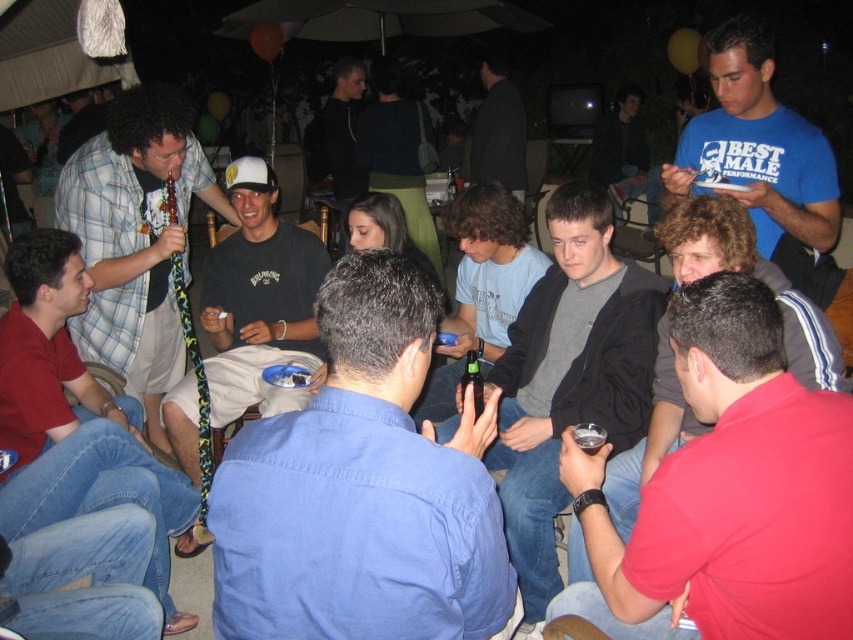
What do you see at coordinates (361, 488) in the screenshot?
I see `blue cotton shirt at center` at bounding box center [361, 488].

Is blue cotton shirt at center bigger than light blue shirt at center?

No, blue cotton shirt at center is not bigger than light blue shirt at center.

Which is in front, point (227, 618) or point (492, 352)?

Point (227, 618) is more forward.

Identify the location of blue cotton shirt at center. (361, 488).

Where is `plaid shirt at center`? plaid shirt at center is located at coordinates (136, 237).

This screenshot has width=853, height=640. Describe the element at coordinates (136, 237) in the screenshot. I see `plaid shirt at center` at that location.

At what (x,y) coordinates should I click in order to perform the action: click on plaid shirt at center. Please return your answer as a coordinate pair (x, y). The width and height of the screenshot is (853, 640). Looking at the image, I should click on (136, 237).

Who is positioned more to the left, matte black shirt at center or plaid shirt at center?

Positioned to the left is matte black shirt at center.

Does matte black shirt at center have a lesser width compared to plaid shirt at center?

No.

Is point (135, 499) less distant than point (160, 400)?

Yes, it is in front of point (160, 400).

Locate an element on the screen. The image size is (853, 640). matte black shirt at center is located at coordinates (74, 417).